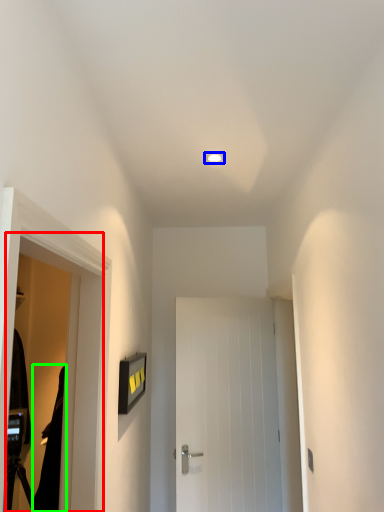
Question: Estimate the real-world distances between objects in this image. Which object is closer to screen door (highlighted by a red box), lighting (highlighted by a blue box) or robe (highlighted by a green box)?

Choices:
 (A) lighting
 (B) robe

Answer: (B)